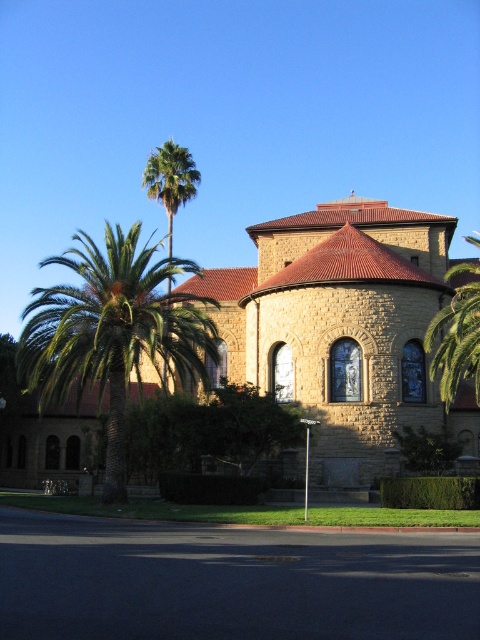
You are standing in front of the historic building and want to take a photo that includes both the green leafy palm at left and the green leafy palm at upper left. Which palm tree should you position closer to the camera to ensure both are in focus?

You should position the green leafy palm at left closer to the camera since it is already closer to the viewer than the green leafy palm at upper left, ensuring both are in focus by maintaining their relative distances.

You are standing at the entrance of the brown stone church at center. Where are you in relation to the point marked at coordinates (x=343, y=328)?

You are standing at the point marked at coordinates (x=343, y=328) because the brown stone church at center is located at that point, and you are at its entrance.

You are planning to take a photo of the brown stone church at center and the green leafy palm tree at right. Which object takes up more area in the photo?

The green leafy palm tree at right takes up more area in the photo because it occupies more space than the brown stone church at center.